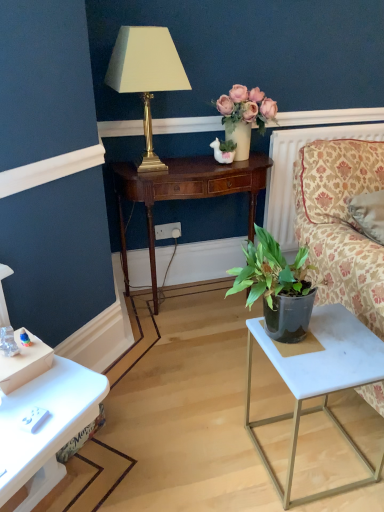
The image size is (384, 512). Identify the location of vacant space behind white marble side table at lower right. (264, 391).